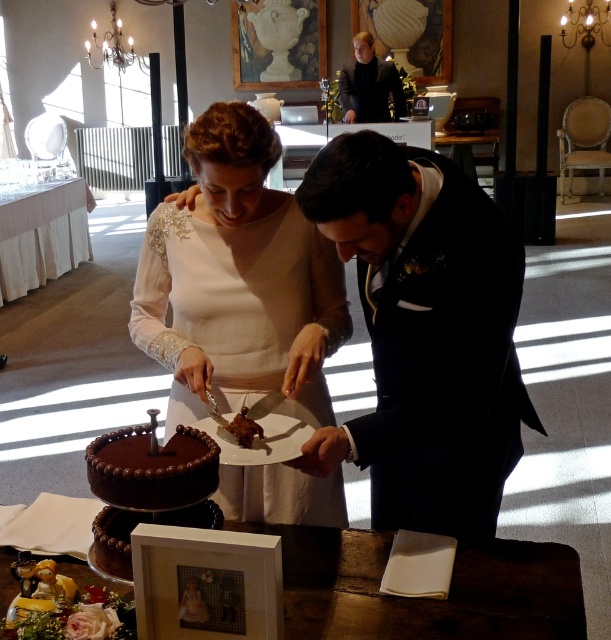
Question: Among these objects, which one is nearest to the camera?

Choices:
 (A) black satin suit at center
 (B) matte white dress at center
 (C) chocolatesmoothwedding cake at center
 (D) white cloth table at upper left

Answer: (C)

Question: Does black satin suit at center have a lesser width compared to marble vase at upper center?

Choices:
 (A) yes
 (B) no

Answer: (A)

Question: Is wooden table at center bigger than chocolatesmoothwedding cake at center?

Choices:
 (A) yes
 (B) no

Answer: (A)

Question: Is chocolatesmoothwedding cake at center thinner than white cloth table at upper left?

Choices:
 (A) yes
 (B) no

Answer: (A)

Question: Which point is farther to the camera?

Choices:
 (A) marble vase at upper center
 (B) black satin suit at center
 (C) wooden table at center
 (D) white cloth table at upper left

Answer: (A)

Question: Estimate the real-world distances between objects in this image. Which object is farther from the black satin suit at center?

Choices:
 (A) wooden table at center
 (B) marble vase at upper center
 (C) chocolatesmoothwedding cake at center

Answer: (B)